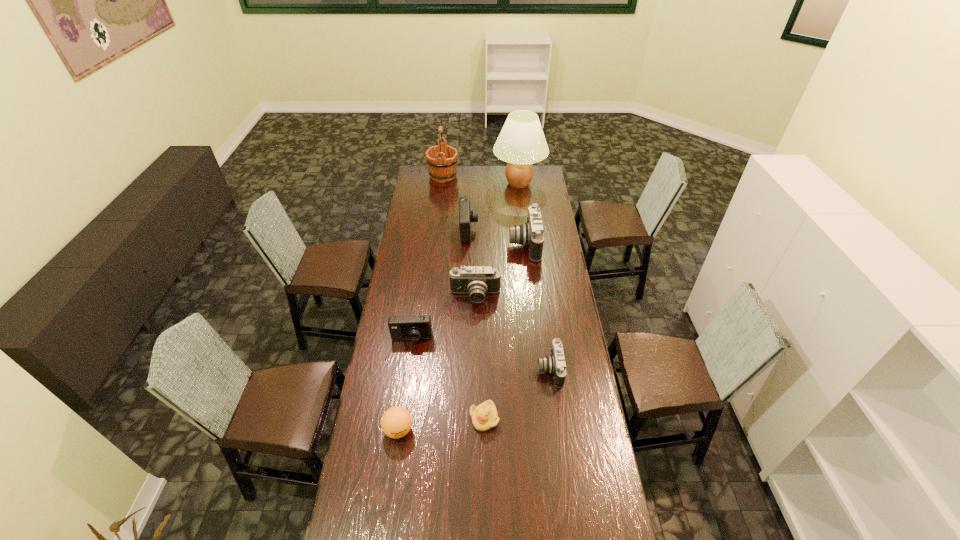
Locate an element on the screen. the left blue camera is located at coordinates (417, 327).

In order to click on the nearer blue camera in this screenshot , I will do `click(417, 327)`.

I want to click on the smallest black camera, so click(554, 364).

At what (x,y) coordinates should I click in order to perform the action: click on the seventh farthest object. Please return your answer as a coordinate pair (x, y). The height and width of the screenshot is (540, 960). Looking at the image, I should click on (554, 364).

Image resolution: width=960 pixels, height=540 pixels. In order to click on ping-pong ball in this screenshot , I will do `click(396, 422)`.

I want to click on yellow duckling, so click(x=484, y=416).

This screenshot has width=960, height=540. Identify the location of duckling. (484, 416).

Find the location of a particular element. vacant space situated 0.170m on the shade of the lampshade is located at coordinates (522, 215).

Where is `vacant point located 0.380m on the front of the second tallest object`? vacant point located 0.380m on the front of the second tallest object is located at coordinates (438, 221).

I want to click on blank space located 0.200m on the front-facing side of the farthest black camera, so click(x=472, y=244).